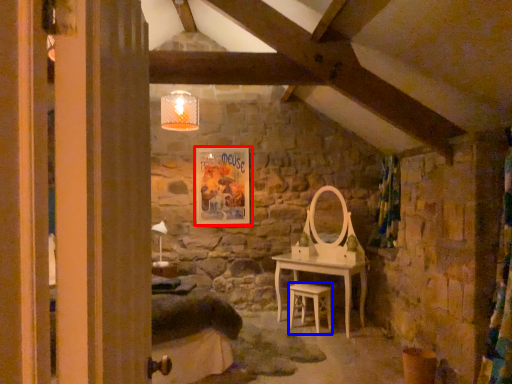
Question: Which object is closer to the camera taking this photo, picture frame (highlighted by a red box) or chair (highlighted by a blue box)?

Choices:
 (A) picture frame
 (B) chair

Answer: (B)